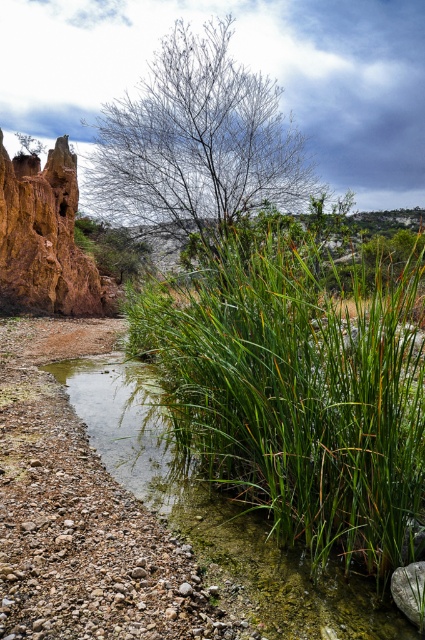
Question: Does green leafy grass at center have a smaller size compared to bare branches at upper center?

Choices:
 (A) no
 (B) yes

Answer: (A)

Question: Which point is farther to the camera?

Choices:
 (A) green leafy grass at center
 (B) rustic clay cliff at left

Answer: (B)

Question: Can you confirm if green leafy grass at center is positioned above rustic clay cliff at left?

Choices:
 (A) no
 (B) yes

Answer: (A)

Question: Can you confirm if green leafy grass at center is positioned to the right of bare branches at upper center?

Choices:
 (A) no
 (B) yes

Answer: (B)

Question: Which point appears closest to the camera in this image?

Choices:
 (A) (289, 164)
 (B) (39, 220)
 (C) (325, 522)

Answer: (C)

Question: Which of the following is the farthest from the observer?

Choices:
 (A) rustic clay cliff at left
 (B) green leafy grass at center
 (C) bare branches at upper center

Answer: (A)